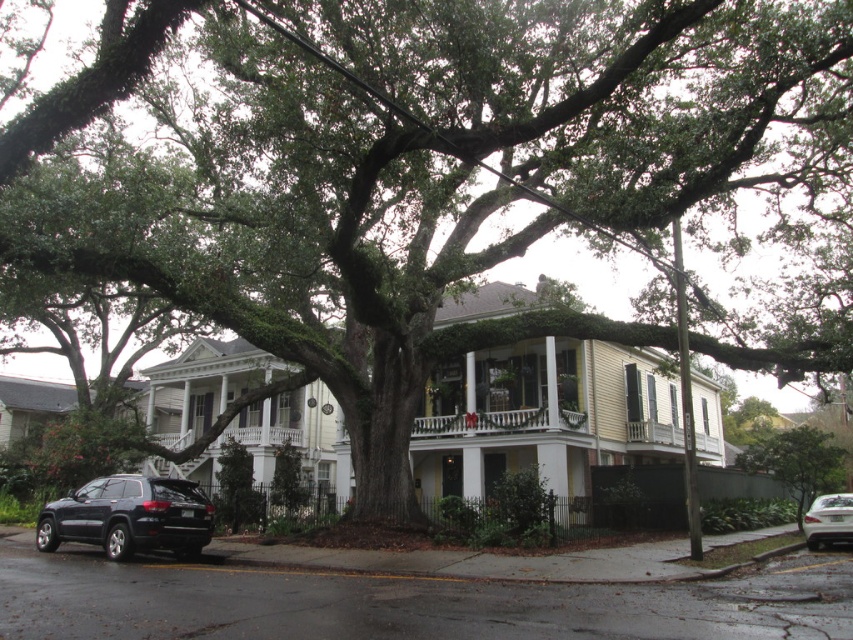
You are a photographer planning to take a picture of the house while standing at the front yard. The green leafy tree at center and the silver metallic sedan at lower right are both in your view. Which object will appear larger in your photo?

The green leafy tree at center will appear larger in the photo because it is much taller than the silver metallic sedan at lower right.

You are driving a car and want to park in the driveway behind the green leafy tree at center. Can you park there if there is a black matte suv at lower left blocking the way?

The black matte suv at lower left is in front of the green leafy tree at center, so it is blocking the driveway behind the tree. You cannot park there until the suv moves.

You are standing at the entrance of the house and want to park your car behind the white painted wood porch at center so it is hidden from view. Is the black matte suv at lower left currently blocking that parking spot?

The black matte suv at lower left is in front of the white painted wood porch at center, so it is blocking the parking spot behind the porch. You will need to move the suv to park your car there without obstruction.